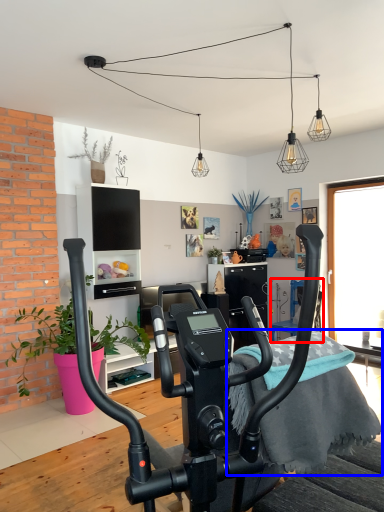
Question: Which point is closer to the camera, armchair (highlighted by a red box) or bedding (highlighted by a blue box)?

Choices:
 (A) armchair
 (B) bedding

Answer: (B)